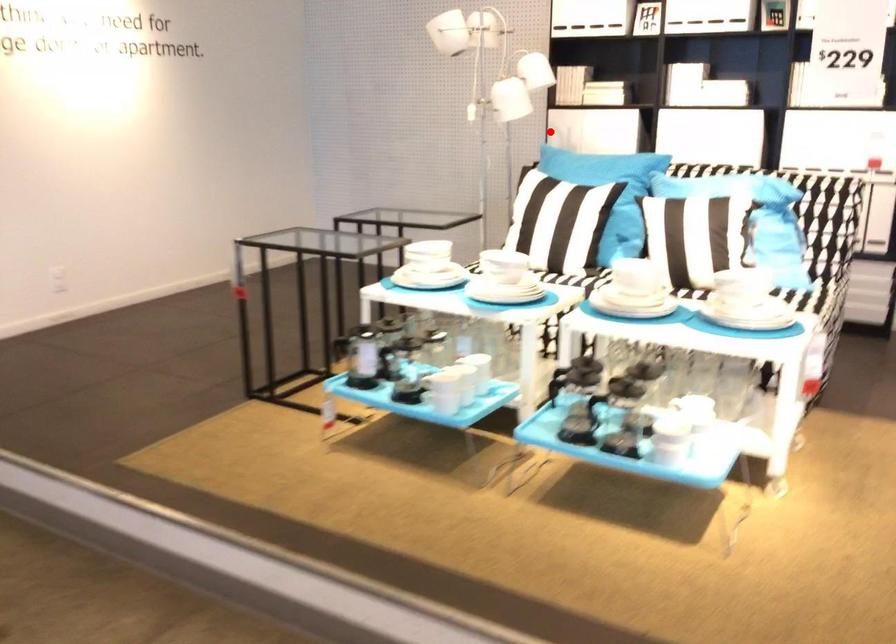
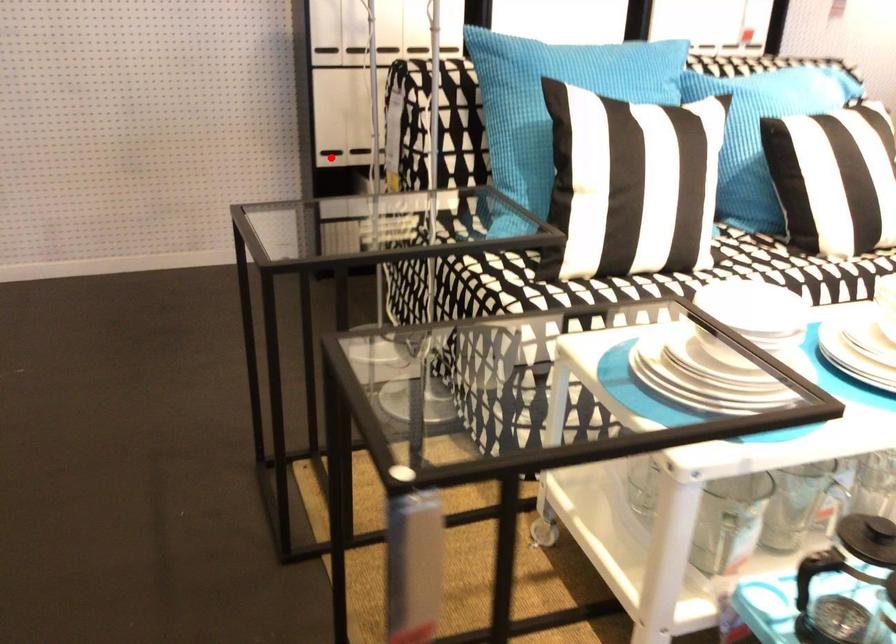
I am providing you with two images of the same scene from different viewpoints. A red point is marked on the first image and another point is marked on the second image. Do the highlighted points in image1 and image2 indicate the same real-world spot?

No